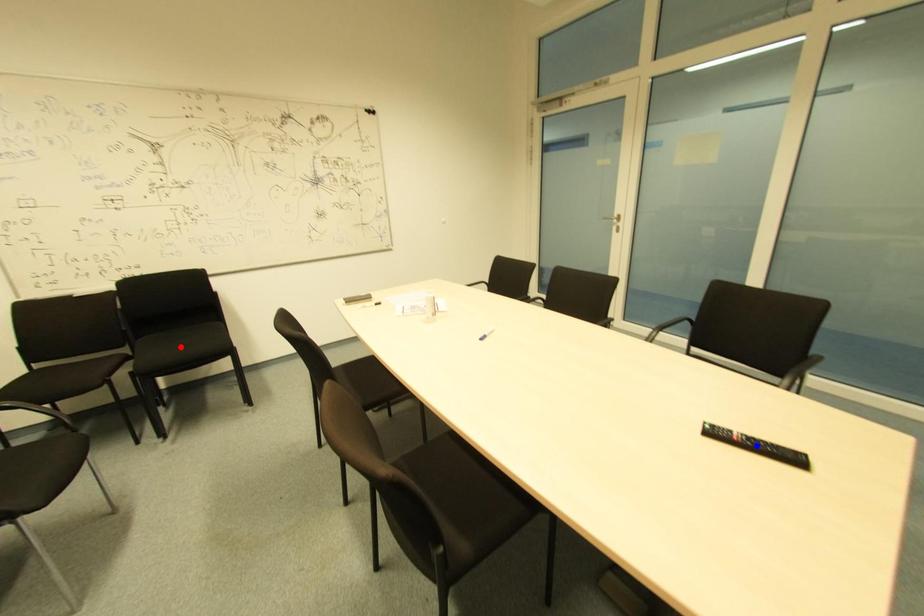
Question: Two points are marked on the image. Which point is closer to the camera?

Choices:
 (A) Blue point is closer.
 (B) Red point is closer.

Answer: (A)